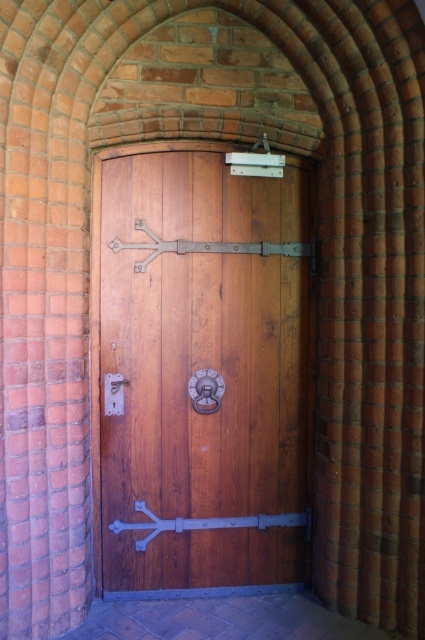
Can you confirm if wooden door at center is smaller than matte silver lock at center?

No.

Between wooden door at center and matte silver lock at center, which one is positioned higher?

wooden door at center

Does point (243, 340) come in front of point (121, 404)?

That is False.

Locate an element on the screen. The image size is (425, 640). wooden door at center is located at coordinates (206, 371).